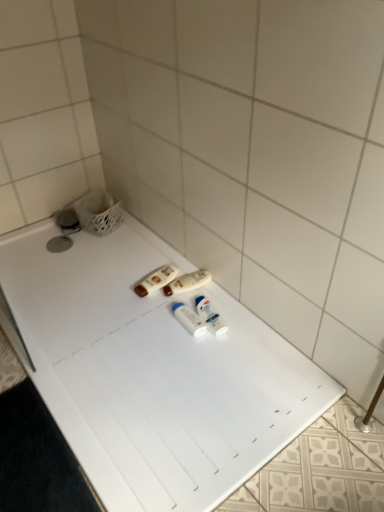
This screenshot has height=512, width=384. I want to click on unoccupied region to the right of white plastic bottles at center, the 3th toiletry when ordered from left to right, so click(x=233, y=327).